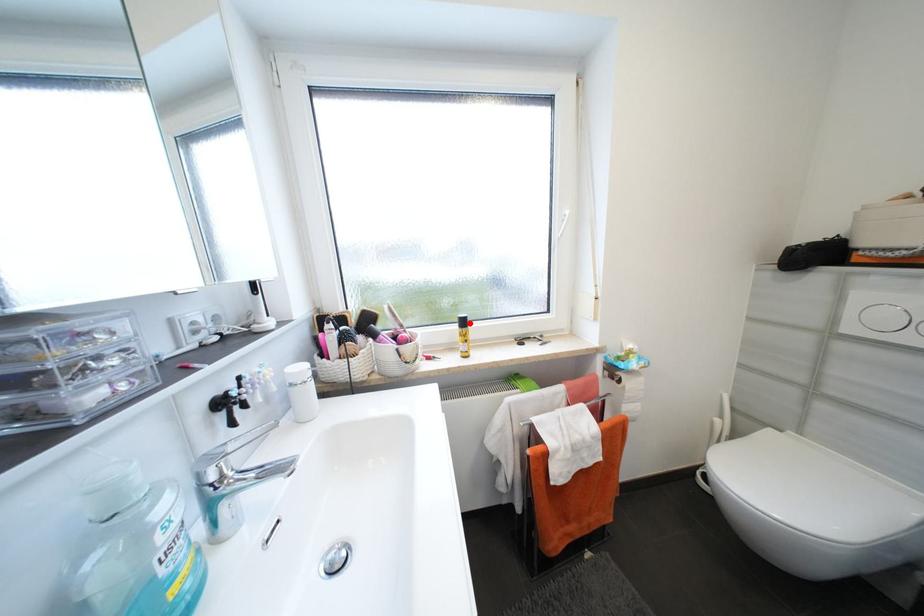
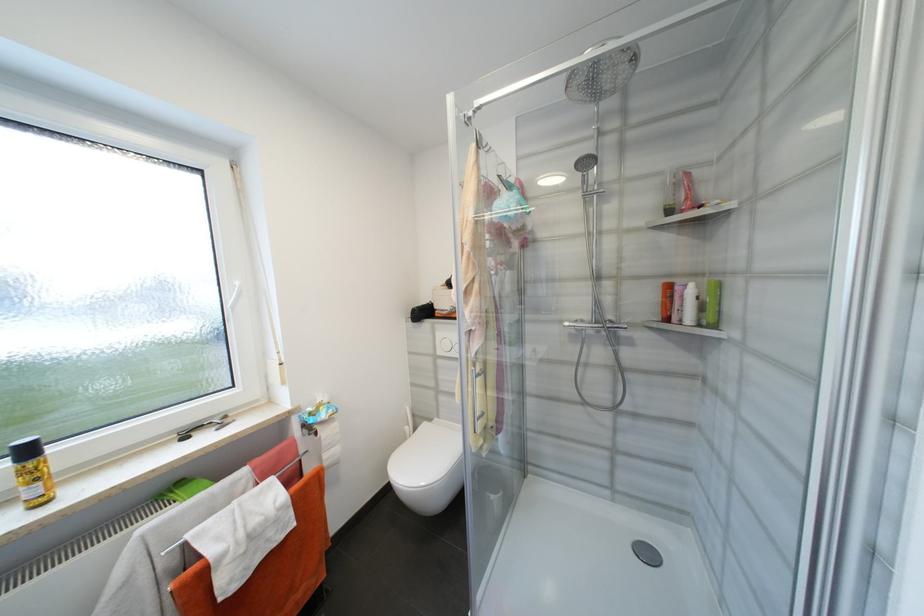
In the second image, find the point that corresponds to the highlighted location in the first image.

(33, 453)